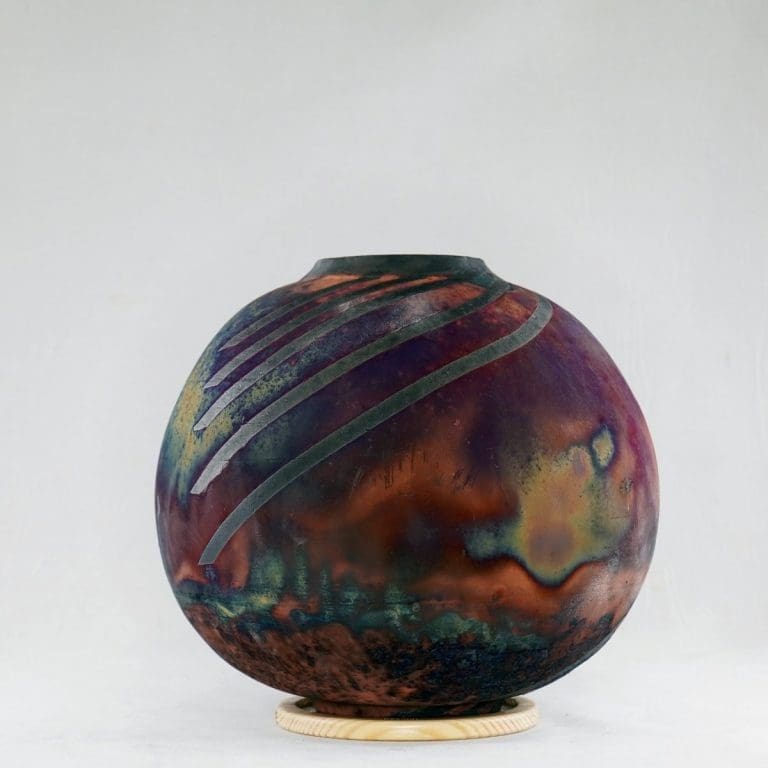
In order to click on woodgrain on right side of base in this screenshot , I will do `click(487, 726)`.